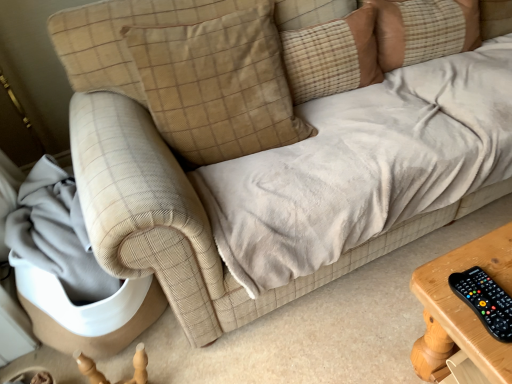
How much space does beige corduroy pillow at upper center, marked as the first pillow in a left-to-right arrangement, occupy horizontally?

beige corduroy pillow at upper center, marked as the first pillow in a left-to-right arrangement, is 16.35 inches in width.

Image resolution: width=512 pixels, height=384 pixels. Describe the element at coordinates (485, 301) in the screenshot. I see `black plastic remote at lower right` at that location.

At what (x,y) coordinates should I click in order to perform the action: click on brown plaid pillow at upper center, the second pillow from the right. Please return your answer as a coordinate pair (x, y). Looking at the image, I should click on (327, 47).

Is the surface of black plastic remote at lower right in direct contact with brown plaid pillow at upper center, the second pillow in the left-to-right sequence?

They are not placed beside each other.

Considering the positions of objects black plastic remote at lower right and brown plaid pillow at upper center, the second pillow from the right, in the image provided, who is more to the right, black plastic remote at lower right or brown plaid pillow at upper center, the second pillow from the right,?

black plastic remote at lower right is more to the right.

Consider the image. Considering their positions, is black plastic remote at lower right located in front of or behind brown plaid pillow at upper center, the second pillow in the left-to-right sequence?

In the image, black plastic remote at lower right appears in front of brown plaid pillow at upper center, the second pillow in the left-to-right sequence.

Can you confirm if black plastic remote at lower right is smaller than brown plaid pillow at upper center, the second pillow from the right?

Yes, black plastic remote at lower right is smaller than brown plaid pillow at upper center, the second pillow from the right.

Can you confirm if brown plaid pillow at upper center, the second pillow in the left-to-right sequence, is wider than black plastic remote at lower right?

Yes.

Is brown plaid pillow at upper center, the second pillow from the right, aimed at black plastic remote at lower right?

Yes, brown plaid pillow at upper center, the second pillow from the right, faces towards black plastic remote at lower right.

Considering the relative sizes of brown plaid pillow at upper center, the second pillow in the left-to-right sequence, and black plastic remote at lower right in the image provided, is brown plaid pillow at upper center, the second pillow in the left-to-right sequence, bigger than black plastic remote at lower right?

Indeed, brown plaid pillow at upper center, the second pillow in the left-to-right sequence, has a larger size compared to black plastic remote at lower right.

Can you tell me how much brown plaid pillow at upper center, the second pillow from the right, and black plastic remote at lower right differ in facing direction?

The facing directions of brown plaid pillow at upper center, the second pillow from the right, and black plastic remote at lower right are 11.1 degrees apart.

Consider the image. Is the surface of black plastic remote at lower right in direct contact with beige corduroy pillow at upper center, marked as the first pillow in a left-to-right arrangement?

black plastic remote at lower right and beige corduroy pillow at upper center, marked as the first pillow in a left-to-right arrangement, are clearly separated.

Consider the image. Considering the sizes of objects black plastic remote at lower right and beige corduroy pillow at upper center, the third pillow when ordered from right to left, in the image provided, who is smaller, black plastic remote at lower right or beige corduroy pillow at upper center, the third pillow when ordered from right to left,?

black plastic remote at lower right.

Does point (466, 285) come farther from viewer compared to point (216, 88)?

No, it is not.

Is the position of black plastic remote at lower right less distant than that of beige corduroy pillow at upper center, marked as the first pillow in a left-to-right arrangement?

Yes, it is.

Is beige corduroy pillow at upper center, the third pillow when ordered from right to left, placed right next to brown plaid pillow at upper center, the second pillow from the right?

There is a gap between beige corduroy pillow at upper center, the third pillow when ordered from right to left, and brown plaid pillow at upper center, the second pillow from the right.

Is beige corduroy pillow at upper center, marked as the first pillow in a left-to-right arrangement, to the right of brown plaid pillow at upper center, the second pillow in the left-to-right sequence, from the viewer's perspective?

In fact, beige corduroy pillow at upper center, marked as the first pillow in a left-to-right arrangement, is to the left of brown plaid pillow at upper center, the second pillow in the left-to-right sequence.

The image size is (512, 384). Find the location of `pillow positioned vertically above the brown plaid pillow at upper center, the second pillow from the right (from a real-world perspective)`. pillow positioned vertically above the brown plaid pillow at upper center, the second pillow from the right (from a real-world perspective) is located at coordinates (218, 84).

Looking at their sizes, would you say beige corduroy pillow at upper center, the third pillow when ordered from right to left, is wider or thinner than brown plaid pillow at upper center, the second pillow in the left-to-right sequence?

Considering their sizes, beige corduroy pillow at upper center, the third pillow when ordered from right to left, looks broader than brown plaid pillow at upper center, the second pillow in the left-to-right sequence.

Is black plastic remote at lower right facing away from beige corduroy pillow at upper center, which is the 1th pillow in right-to-left order?

No, beige corduroy pillow at upper center, which is the 1th pillow in right-to-left order, is not at the back of black plastic remote at lower right.

Considering the positions of objects black plastic remote at lower right and beige corduroy pillow at upper center, the third pillow viewed from the left, in the image provided, who is more to the right, black plastic remote at lower right or beige corduroy pillow at upper center, the third pillow viewed from the left,?

beige corduroy pillow at upper center, the third pillow viewed from the left, is more to the right.

Is black plastic remote at lower right positioned far away from beige corduroy pillow at upper center, the third pillow viewed from the left?

Yes, black plastic remote at lower right is far from beige corduroy pillow at upper center, the third pillow viewed from the left.

How much distance is there between brown plaid pillow at upper center, the second pillow from the right, and beige corduroy pillow at upper center, which is the 1th pillow in right-to-left order?

8.59 inches.

Which is behind, point (289, 37) or point (383, 52)?

The point (383, 52) is farther.

Is beige corduroy pillow at upper center, the third pillow viewed from the left, completely or partially inside brown plaid pillow at upper center, the second pillow in the left-to-right sequence?

No, brown plaid pillow at upper center, the second pillow in the left-to-right sequence, does not contain beige corduroy pillow at upper center, the third pillow viewed from the left.

Is brown plaid pillow at upper center, the second pillow in the left-to-right sequence, not near beige corduroy pillow at upper center, which is the 1th pillow in right-to-left order?

brown plaid pillow at upper center, the second pillow in the left-to-right sequence, is actually quite close to beige corduroy pillow at upper center, which is the 1th pillow in right-to-left order.

Can you confirm if brown plaid pillow at upper center, the second pillow from the right, is taller than beige corduroy pillow at upper center, the third pillow when ordered from right to left?

No.

How many degrees apart are the facing directions of brown plaid pillow at upper center, the second pillow from the right, and beige corduroy pillow at upper center, the third pillow when ordered from right to left?

The angular difference between brown plaid pillow at upper center, the second pillow from the right, and beige corduroy pillow at upper center, the third pillow when ordered from right to left, is 1.22 degrees.

Considering the sizes of brown plaid pillow at upper center, the second pillow from the right, and beige corduroy pillow at upper center, the third pillow when ordered from right to left, in the image, is brown plaid pillow at upper center, the second pillow from the right, wider or thinner than beige corduroy pillow at upper center, the third pillow when ordered from right to left,?

brown plaid pillow at upper center, the second pillow from the right, is thinner than beige corduroy pillow at upper center, the third pillow when ordered from right to left.

Which is more to the right, brown plaid pillow at upper center, the second pillow in the left-to-right sequence, or beige corduroy pillow at upper center, the third pillow when ordered from right to left?

Positioned to the right is brown plaid pillow at upper center, the second pillow in the left-to-right sequence.

The width and height of the screenshot is (512, 384). I want to click on control beneath the brown plaid pillow at upper center, the second pillow in the left-to-right sequence (from a real-world perspective), so click(x=485, y=301).

From the black plastic remote at lower right, count 2nd pillows backward and point to it. Please provide its 2D coordinates.

[(327, 47)]

Estimate the real-world distances between objects in this image. Which object is further from beige corduroy pillow at upper center, which is the 1th pillow in right-to-left order, black plastic remote at lower right or beige corduroy pillow at upper center, marked as the first pillow in a left-to-right arrangement?

Based on the image, black plastic remote at lower right appears to be further to beige corduroy pillow at upper center, which is the 1th pillow in right-to-left order.

Estimate the real-world distances between objects in this image. Which object is further from beige corduroy pillow at upper center, which is the 1th pillow in right-to-left order, beige corduroy pillow at upper center, marked as the first pillow in a left-to-right arrangement, or black plastic remote at lower right?

The object further to beige corduroy pillow at upper center, which is the 1th pillow in right-to-left order, is black plastic remote at lower right.

From the image, which object appears to be nearer to beige corduroy pillow at upper center, marked as the first pillow in a left-to-right arrangement, brown plaid pillow at upper center, the second pillow from the right, or black plastic remote at lower right?

brown plaid pillow at upper center, the second pillow from the right, lies closer to beige corduroy pillow at upper center, marked as the first pillow in a left-to-right arrangement, than the other object.

When comparing their distances from black plastic remote at lower right, does beige corduroy pillow at upper center, marked as the first pillow in a left-to-right arrangement, or beige corduroy pillow at upper center, the third pillow viewed from the left, seem closer?

beige corduroy pillow at upper center, marked as the first pillow in a left-to-right arrangement.

Based on their spatial positions, is black plastic remote at lower right or brown plaid pillow at upper center, the second pillow from the right, further from beige corduroy pillow at upper center, the third pillow when ordered from right to left?

black plastic remote at lower right.

Estimate the real-world distances between objects in this image. Which object is further from beige corduroy pillow at upper center, the third pillow when ordered from right to left, beige corduroy pillow at upper center, the third pillow viewed from the left, or brown plaid pillow at upper center, the second pillow in the left-to-right sequence?

beige corduroy pillow at upper center, the third pillow viewed from the left.

When comparing their distances from brown plaid pillow at upper center, the second pillow from the right, does black plastic remote at lower right or beige corduroy pillow at upper center, marked as the first pillow in a left-to-right arrangement, seem closer?

The object closer to brown plaid pillow at upper center, the second pillow from the right, is beige corduroy pillow at upper center, marked as the first pillow in a left-to-right arrangement.

Which object lies further to the anchor point brown plaid pillow at upper center, the second pillow in the left-to-right sequence, black plastic remote at lower right or beige corduroy pillow at upper center, which is the 1th pillow in right-to-left order?

Based on the image, black plastic remote at lower right appears to be further to brown plaid pillow at upper center, the second pillow in the left-to-right sequence.

Locate an element on the screen. Image resolution: width=512 pixels, height=384 pixels. pillow situated between beige corduroy pillow at upper center, marked as the first pillow in a left-to-right arrangement, and beige corduroy pillow at upper center, which is the 1th pillow in right-to-left order, from left to right is located at coordinates (327, 47).

You are a GUI agent. You are given a task and a screenshot of the screen. Output one action in this format:
    pyautogui.click(x=<x>, y=<y>)
    Task: Click on the pillow between brown plaid pillow at upper center, the second pillow in the left-to-right sequence, and black plastic remote at lower right vertically
    
    Given the screenshot: What is the action you would take?
    pyautogui.click(x=218, y=84)